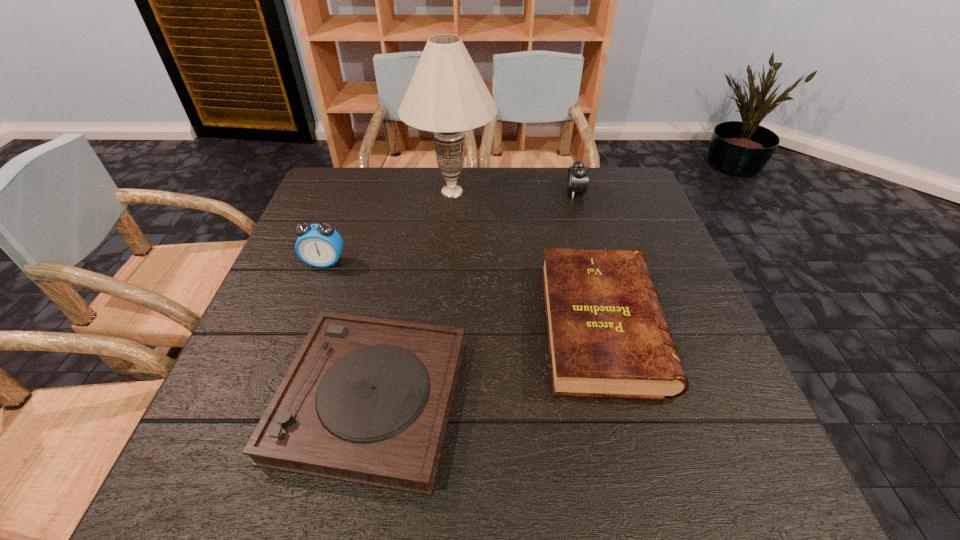
At what (x,y) coordinates should I click in order to perform the action: click on free space located on the front side of the shorter alarm clock. Please return your answer as a coordinate pair (x, y). The image size is (960, 540). Looking at the image, I should click on (523, 192).

Where is `vacant space situated 0.060m on the front side of the shorter alarm clock`? The width and height of the screenshot is (960, 540). vacant space situated 0.060m on the front side of the shorter alarm clock is located at coordinates (546, 192).

The width and height of the screenshot is (960, 540). What are the coordinates of `free space located on the left of the hardback book` in the screenshot? It's located at (356, 326).

Identify the location of vacant space positioned on the right of the shortest object. (614, 399).

Identify the location of lampshade present at the far edge. (446, 95).

Where is `alarm clock present at the far edge`? alarm clock present at the far edge is located at coordinates (577, 181).

What are the coordinates of `object located at the near edge` in the screenshot? It's located at (366, 400).

Locate an element on the screen. This screenshot has height=540, width=960. alarm clock that is positioned at the left edge is located at coordinates (319, 245).

The width and height of the screenshot is (960, 540). What are the coordinates of `phonograph record that is positioned at the left edge` in the screenshot? It's located at (366, 400).

Identify the location of object located in the right edge section of the desktop. (608, 338).